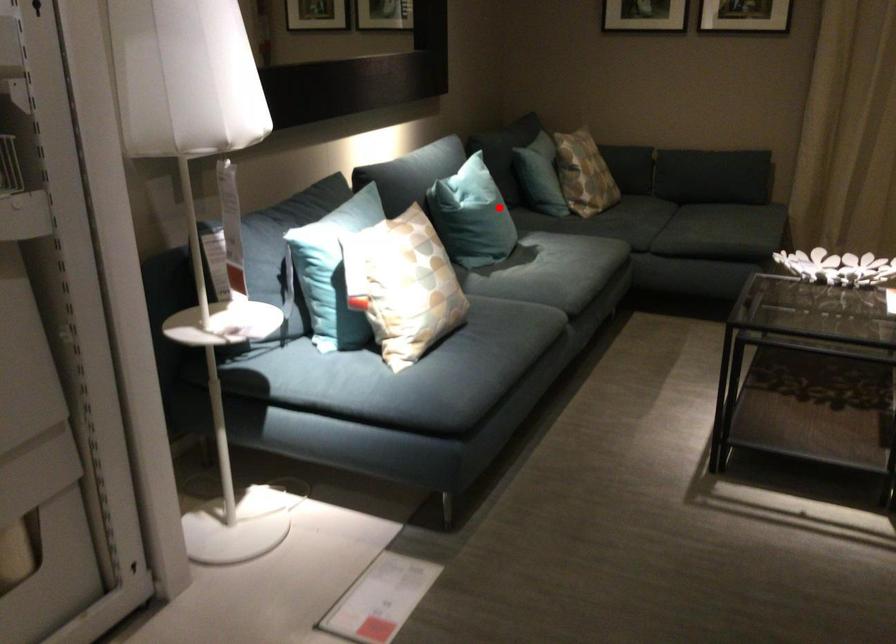
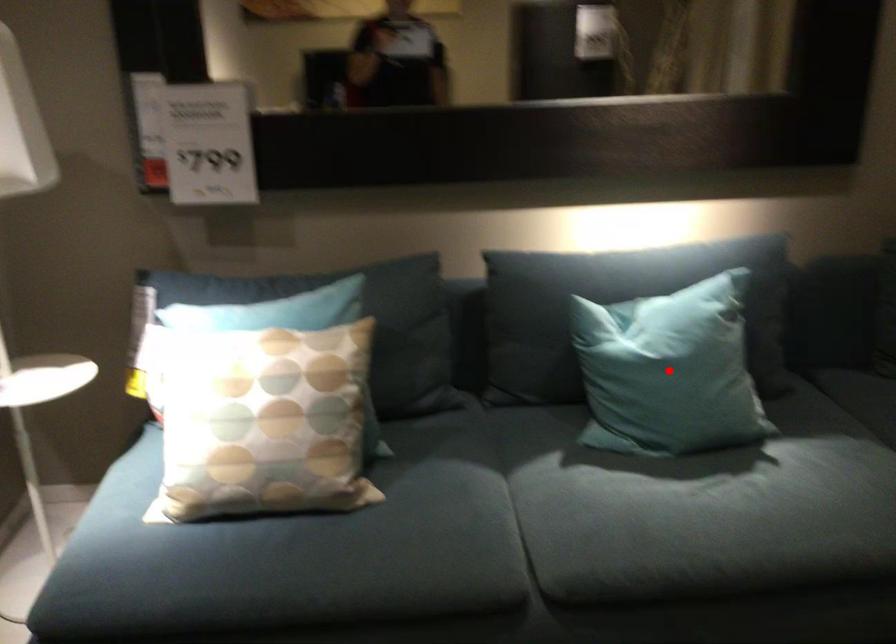
I am providing you with two images of the same scene from different viewpoints. A red point is marked on the first image and another point is marked on the second image. Do the highlighted points in image1 and image2 indicate the same real-world spot?

Yes